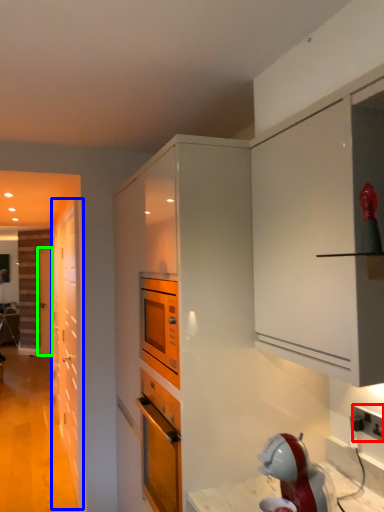
Question: Which object is positioned closest to electric outlet (highlighted by a red box)? Select from door (highlighted by a blue box) and door (highlighted by a green box).

Choices:
 (A) door
 (B) door

Answer: (A)